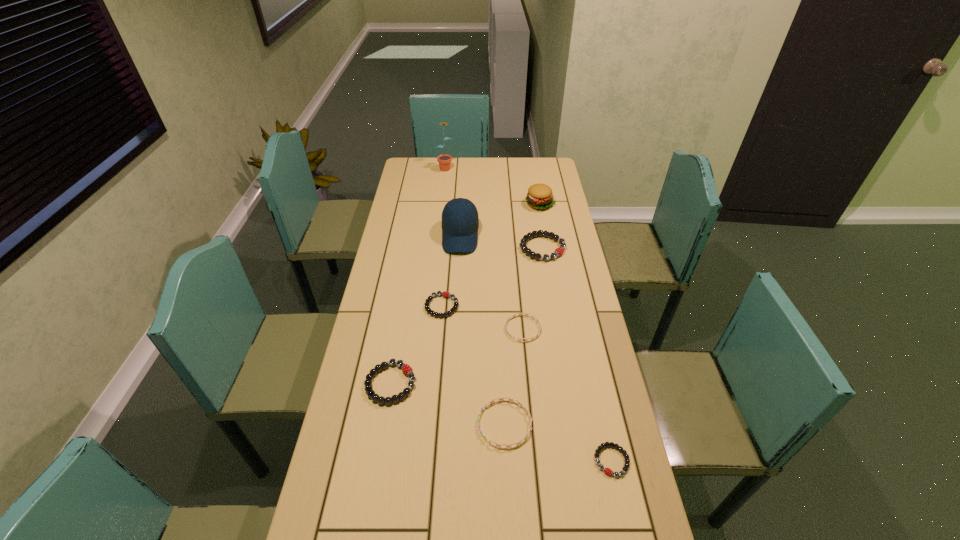
Identify the location of the tallest object. (444, 160).

This screenshot has height=540, width=960. Identify the location of sunflower. coord(444,160).

You are a GUI agent. You are given a task and a screenshot of the screen. Output one action in this format:
    pyautogui.click(x=<x>, y=<y>)
    Task: Click on the blue baseball cap
    Image resolution: width=960 pixels, height=540 pixels.
    Given the screenshot: What is the action you would take?
    pyautogui.click(x=460, y=222)

The height and width of the screenshot is (540, 960). Find the location of `the second tallest object`. the second tallest object is located at coordinates (460, 222).

You are a GUI agent. You are given a task and a screenshot of the screen. Output one action in this format:
    pyautogui.click(x=<x>, y=<y>)
    Task: Click on the hamburger
    The image size is (960, 540).
    Given the screenshot: What is the action you would take?
    pyautogui.click(x=540, y=196)

Where is `the second farthest object`? the second farthest object is located at coordinates 540,196.

The width and height of the screenshot is (960, 540). I want to click on the biggest black bracelet, so click(559, 251).

The height and width of the screenshot is (540, 960). In order to click on the farthest bracelet in this screenshot , I will do coord(559,251).

This screenshot has width=960, height=540. Identify the location of the second tallest bracelet. (406, 369).

Find the location of a particular element. The image size is (960, 540). the second nearest black bracelet is located at coordinates (406, 369).